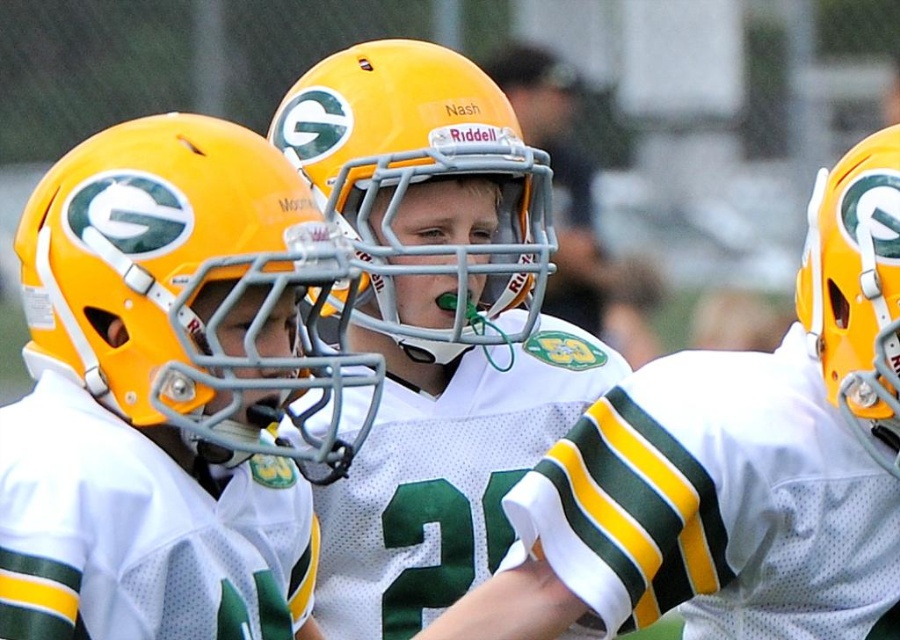
Question: Can you confirm if matte plastic helmet at center is positioned above matte yellow helmet at right?

Choices:
 (A) no
 (B) yes

Answer: (A)

Question: Which point is farther from the camera taking this photo?

Choices:
 (A) (808, 225)
 (B) (464, 276)
 (C) (825, 298)

Answer: (A)

Question: Where is matte yellow football helmet at center located in relation to matte yellow helmet at right in the image?

Choices:
 (A) left
 (B) right

Answer: (A)

Question: Which of these objects is positioned farthest from the matte yellow helmet at center?

Choices:
 (A) matte yellow helmet at right
 (B) matte plastic helmet at center

Answer: (A)

Question: Can you confirm if matte plastic helmet at center is bigger than matte yellow helmet at right?

Choices:
 (A) yes
 (B) no

Answer: (A)

Question: Which of the following is the farthest from the observer?

Choices:
 (A) matte yellow helmet at center
 (B) matte plastic helmet at center
 (C) matte yellow football helmet at center
 (D) matte yellow helmet at right

Answer: (C)